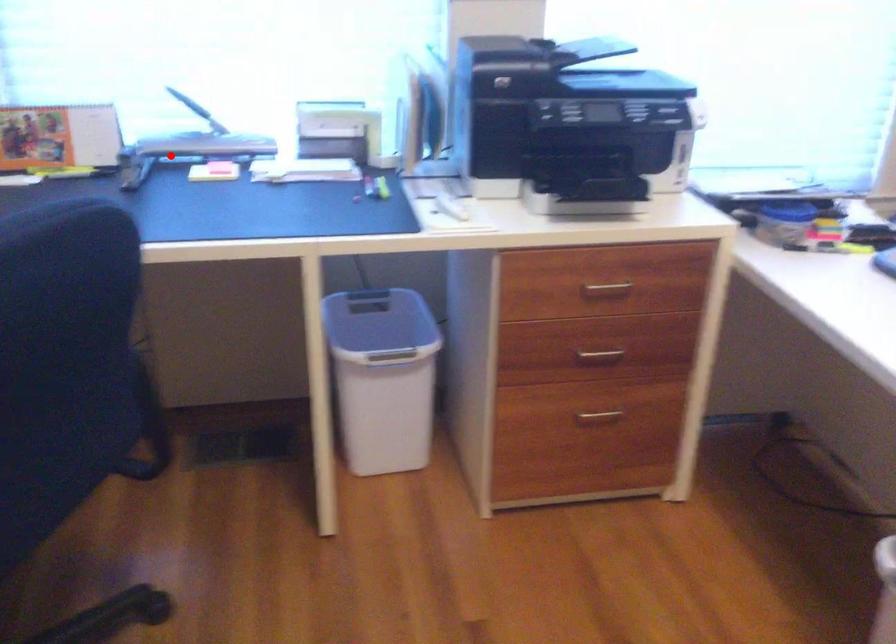
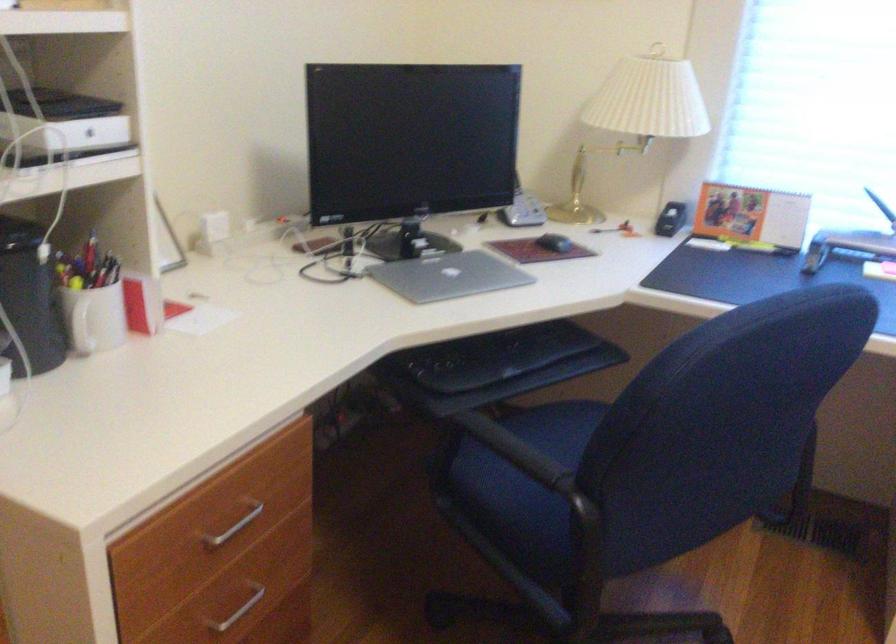
The point at the highlighted location is marked in the first image. Where is the corresponding point in the second image?

(847, 245)